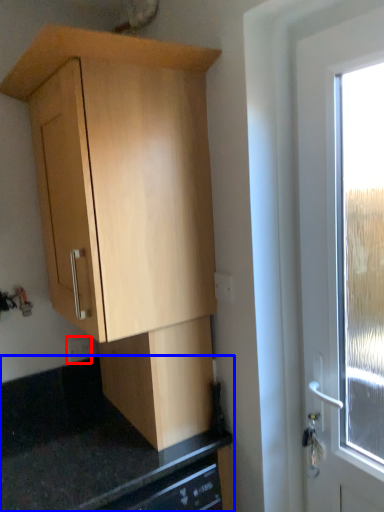
Question: Among these objects, which one is nearest to the camera, electric outlet (highlighted by a red box) or counter top (highlighted by a blue box)?

Choices:
 (A) electric outlet
 (B) counter top

Answer: (B)